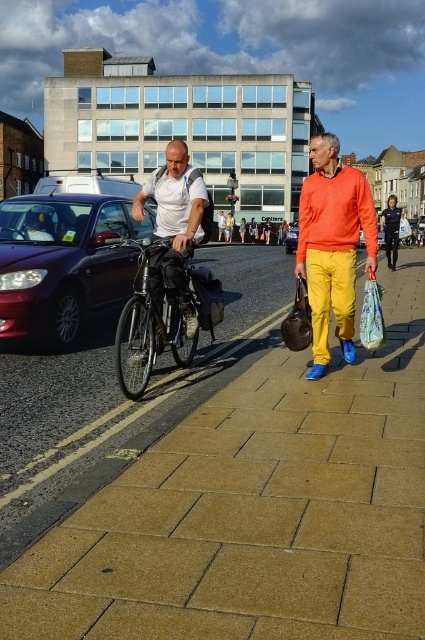
Question: Among these points, which one is farthest from the camera?

Choices:
 (A) (243, 228)
 (B) (40, 240)
 (C) (399, 212)

Answer: (A)

Question: Does shiny black car at left have a lesser width compared to white matte shirt at center?

Choices:
 (A) no
 (B) yes

Answer: (A)

Question: Which point is closer to the camera taking this photo?

Choices:
 (A) (146, 522)
 (B) (91, 266)

Answer: (A)

Question: Can you confirm if brown stone pavement at center is wider than shiny metallic bicycle at center?

Choices:
 (A) yes
 (B) no

Answer: (A)

Question: Among these points, which one is farthest from the camera?

Choices:
 (A) (277, 230)
 (B) (336, 259)
 (C) (350, 481)

Answer: (A)

Question: Does matte orange sweater at center appear over printed fabric shopping bag at right?

Choices:
 (A) no
 (B) yes

Answer: (B)